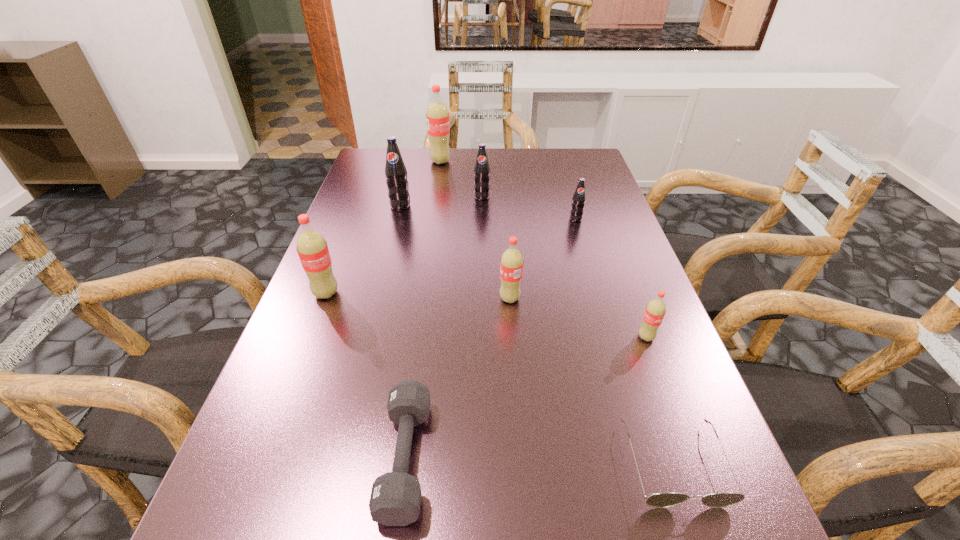
Find the location of a particular element. This screenshot has width=960, height=540. vacant space at the right edge is located at coordinates (579, 238).

This screenshot has width=960, height=540. What are the coordinates of `free space at the far left corner of the desktop` in the screenshot? It's located at (406, 158).

In the image, there is a desktop. Where is `vacant area at the far right corner`? This screenshot has height=540, width=960. vacant area at the far right corner is located at coordinates (563, 165).

Identify the location of free space that is in between the second black pop from right to left and the fourth farthest object. The width and height of the screenshot is (960, 540). (529, 208).

Identify the location of empty space that is in between the biggest red soda and the second shortest object. (423, 310).

Locate an element on the screen. Image resolution: width=960 pixels, height=540 pixels. empty location between the nearest soda and the biggest red soda is located at coordinates (543, 249).

Locate an element on the screen. This screenshot has width=960, height=540. free spot between the fifth object from right to left and the biggest red soda is located at coordinates (461, 179).

Locate an element on the screen. The width and height of the screenshot is (960, 540). free space between the leftmost object and the leftmost black pop is located at coordinates (363, 249).

The image size is (960, 540). I want to click on free point between the second smallest black pop and the leftmost soda, so click(404, 245).

This screenshot has height=540, width=960. Find the location of `vacant region between the fifth object from right to left and the sixth nearest object`. vacant region between the fifth object from right to left and the sixth nearest object is located at coordinates (529, 208).